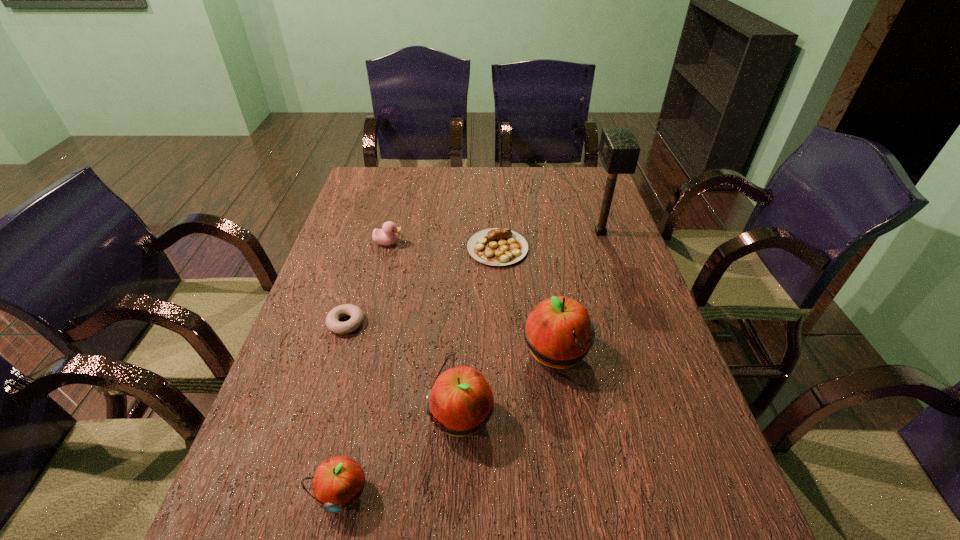
Where is `free space located 0.070m on the back of the leftmost apple`? free space located 0.070m on the back of the leftmost apple is located at coordinates (354, 435).

Where is `free space located 0.170m on the back of the third tallest object`? free space located 0.170m on the back of the third tallest object is located at coordinates (465, 328).

Where is `free space located on the back of the rightmost apple`? free space located on the back of the rightmost apple is located at coordinates (547, 302).

Find the location of `free space located 0.160m on the front-facing side of the third shortest object`. free space located 0.160m on the front-facing side of the third shortest object is located at coordinates (456, 243).

I want to click on blank area located on the front of the steak, so click(x=503, y=358).

Locate an element on the screen. vacant space situated on the front of the tallest object is located at coordinates (614, 274).

Where is `vacant space situated on the right of the shortest object`? The image size is (960, 540). vacant space situated on the right of the shortest object is located at coordinates tap(468, 323).

You are a GUI agent. You are given a task and a screenshot of the screen. Output one action in this format:
    pyautogui.click(x=<x>, y=<y>)
    Task: Click on the object present at the near edge
    
    Given the screenshot: What is the action you would take?
    pyautogui.click(x=338, y=482)

Where is `apple that is positioned at the left edge`? apple that is positioned at the left edge is located at coordinates (338, 482).

Identify the location of duckling that is at the left edge. (387, 235).